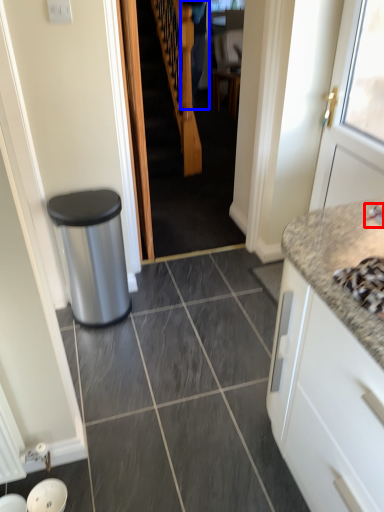
Question: Which point is closer to the camera, faucet (highlighted by a red box) or couple (highlighted by a blue box)?

Choices:
 (A) faucet
 (B) couple

Answer: (A)